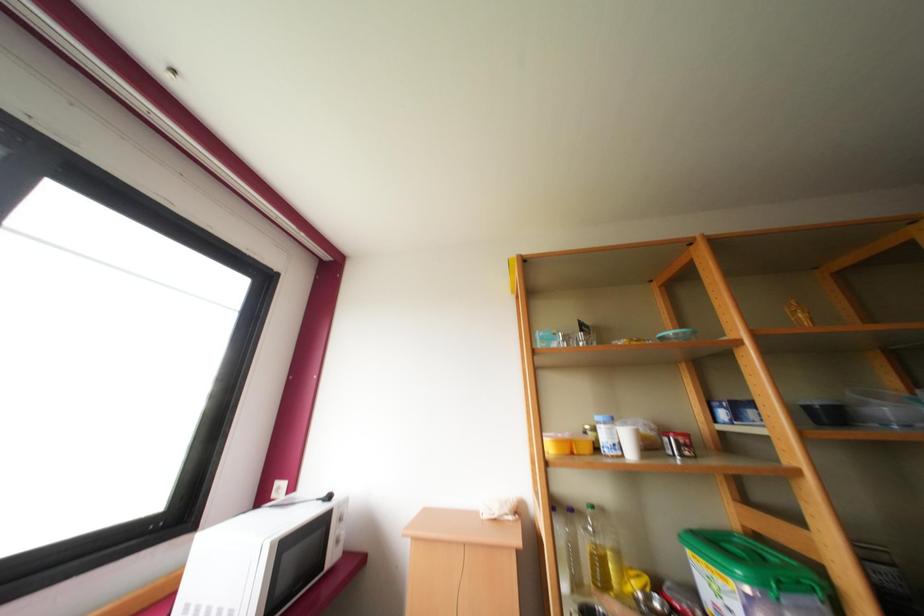
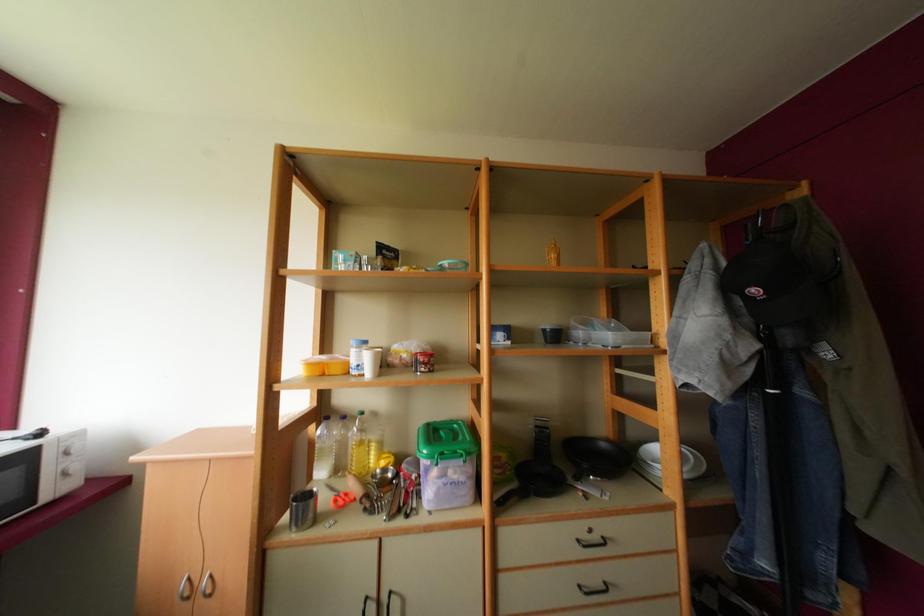
Question: The images are taken continuously from a first-person perspective. In which direction are you moving?

Choices:
 (A) Left
 (B) Right
 (C) Forward
 (D) Backward

Answer: (B)